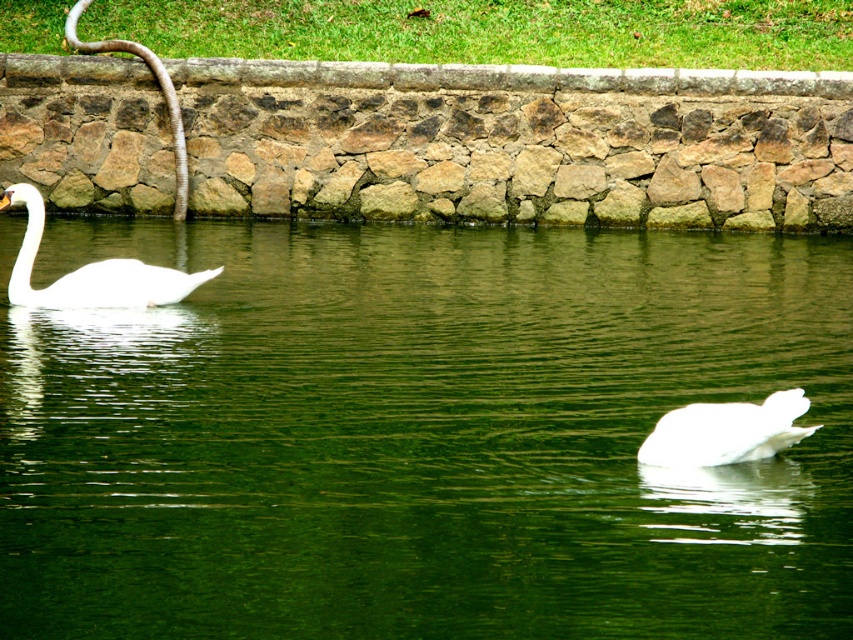
Is point (792, 419) positioned after point (157, 291)?

No, it is in front of (157, 291).

Can you confirm if white matte swan at lower right is shorter than white glossy swan at left?

Yes.

Where is `white matte swan at lower right`? The height and width of the screenshot is (640, 853). white matte swan at lower right is located at coordinates (726, 432).

Who is taller, green smooth water at center or white matte swan at lower right?

green smooth water at center

Can you confirm if green smooth water at center is taller than white matte swan at lower right?

Yes, green smooth water at center is taller than white matte swan at lower right.

Describe the element at coordinates (421, 435) in the screenshot. I see `green smooth water at center` at that location.

What are the coordinates of `green smooth water at center` in the screenshot? It's located at (421, 435).

Is point (717, 564) behind point (21, 282)?

No, it is not.

Is point (495, 356) closer to viewer compared to point (152, 289)?

Yes, it is in front of point (152, 289).

Measure the distance between green smooth water at center and camera.

The distance of green smooth water at center from camera is 6.48 meters.

This screenshot has width=853, height=640. What are the coordinates of `green smooth water at center` in the screenshot? It's located at (421, 435).